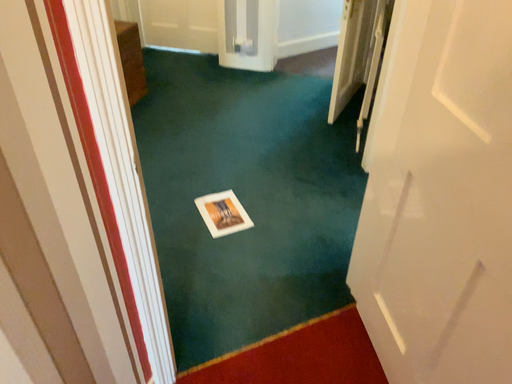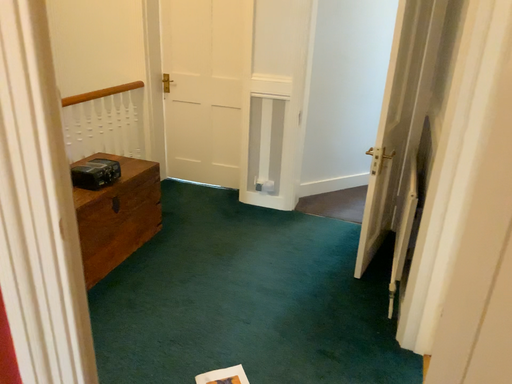
Question: Which way did the camera rotate in the video?

Choices:
 (A) rotated downward
 (B) rotated upward

Answer: (B)